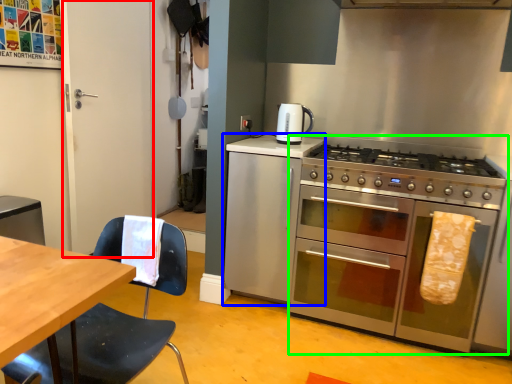
Question: Considering the real-world distances, which object is farthest from glass door (highlighted by a red box)? cabinetry (highlighted by a blue box) or oven (highlighted by a green box)?

Choices:
 (A) cabinetry
 (B) oven

Answer: (B)